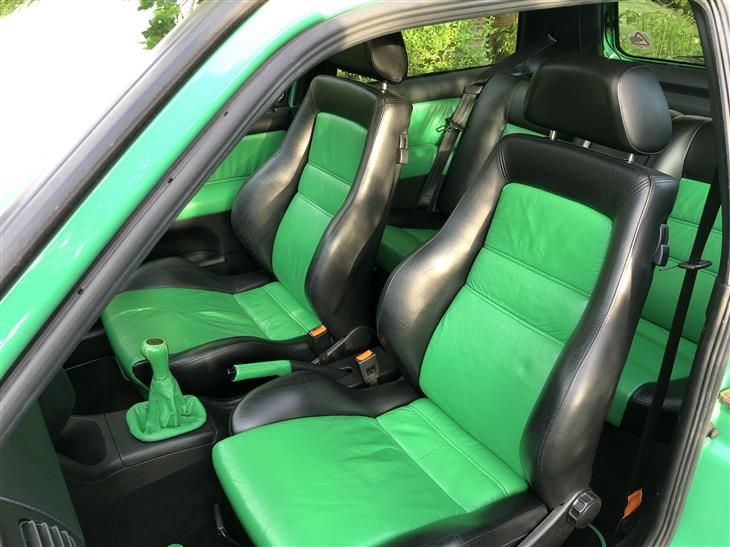
Image resolution: width=730 pixels, height=547 pixels. Find the location of `seat`. seat is located at coordinates (482, 336).